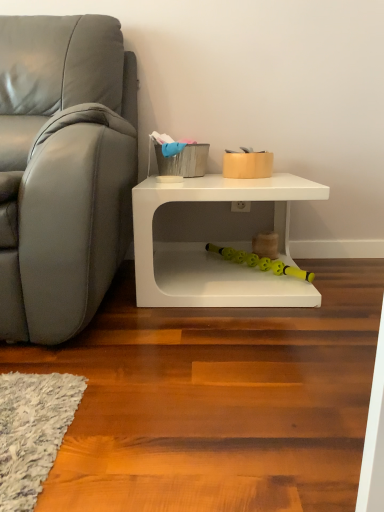
Question: Can we say white matte table at lower right lies outside yellow rubber toy at lower center, marked as the 2th toy in a top-to-bottom arrangement?

Choices:
 (A) no
 (B) yes

Answer: (B)

Question: Is white matte table at lower right beside yellow rubber toy at lower center, marked as the 2th toy in a top-to-bottom arrangement?

Choices:
 (A) no
 (B) yes

Answer: (A)

Question: Is white matte table at lower right far away from yellow rubber toy at lower center, positioned as the 1th toy in bottom-to-top order?

Choices:
 (A) no
 (B) yes

Answer: (A)

Question: Does white matte table at lower right lie behind yellow rubber toy at lower center, marked as the 2th toy in a top-to-bottom arrangement?

Choices:
 (A) no
 (B) yes

Answer: (A)

Question: Considering the relative sizes of white matte table at lower right and yellow rubber toy at lower center, positioned as the 1th toy in bottom-to-top order, in the image provided, is white matte table at lower right wider than yellow rubber toy at lower center, positioned as the 1th toy in bottom-to-top order,?

Choices:
 (A) yes
 (B) no

Answer: (A)

Question: Looking at the image, does matte gold container at center, the second toy when ordered from bottom to top, seem bigger or smaller compared to matte gray couch at left?

Choices:
 (A) small
 (B) big

Answer: (A)

Question: Is matte gold container at center, the second toy when ordered from bottom to top, to the left or to the right of matte gray couch at left in the image?

Choices:
 (A) right
 (B) left

Answer: (A)

Question: Considering the positions of matte gold container at center, the second toy when ordered from bottom to top, and matte gray couch at left in the image, is matte gold container at center, the second toy when ordered from bottom to top, wider or thinner than matte gray couch at left?

Choices:
 (A) wide
 (B) thin

Answer: (B)

Question: Does point (253, 164) appear closer or farther from the camera than point (19, 332)?

Choices:
 (A) closer
 (B) farther

Answer: (B)

Question: From a real-world perspective, is yellow rubber toy at lower center, positioned as the 1th toy in bottom-to-top order, positioned above or below matte gray couch at left?

Choices:
 (A) below
 (B) above

Answer: (A)

Question: Looking at their shapes, would you say yellow rubber toy at lower center, marked as the 2th toy in a top-to-bottom arrangement, is wider or thinner than matte gray couch at left?

Choices:
 (A) wide
 (B) thin

Answer: (B)

Question: From the image's perspective, is yellow rubber toy at lower center, marked as the 2th toy in a top-to-bottom arrangement, located above or below matte gray couch at left?

Choices:
 (A) below
 (B) above

Answer: (A)

Question: In terms of size, does yellow rubber toy at lower center, marked as the 2th toy in a top-to-bottom arrangement, appear bigger or smaller than matte gray couch at left?

Choices:
 (A) small
 (B) big

Answer: (A)

Question: Is matte gray couch at left to the left or to the right of white matte table at lower right in the image?

Choices:
 (A) right
 (B) left

Answer: (B)

Question: In terms of width, does matte gray couch at left look wider or thinner when compared to white matte table at lower right?

Choices:
 (A) wide
 (B) thin

Answer: (A)